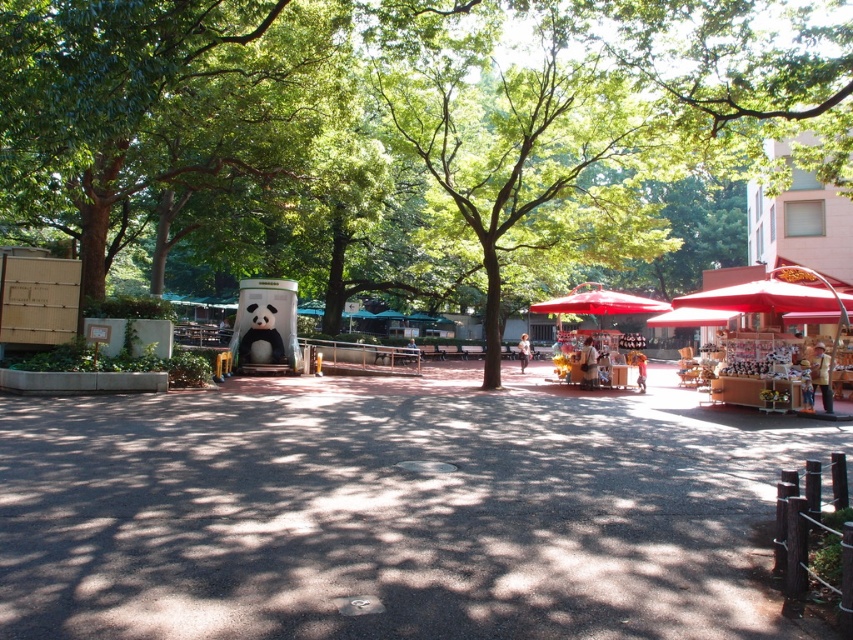
You are standing at the center of the plaza and want to place a new bench. The bench must be placed exactly 2 meters away from the matte red umbrella at center. Which direction should you face to place it?

The answer is north. Since the coordinates of the matte red umbrella at center are given as point [598,301], moving north would place the bench 2 meters away in that direction.

You are a visitor in the park and want to sit under the shade of the green leafy tree at center. However, there is a matte red umbrella at center in the way. Which direction should you move to reach the tree without going near the umbrella?

The green leafy tree at center is to the left of the matte red umbrella at center. To reach the tree without going near the umbrella, you should move to the left side of the matte red umbrella at center.

You are a visitor in the park and want to take a photo of the green leafy tree at center and the matte white vendor at center. Which object should you focus on first if you want to capture both in a single frame without moving the camera?

The green leafy tree at center is larger than the matte white vendor at center, so you should focus on the green leafy tree at center first to ensure it fills the frame appropriately before adjusting for the smaller vendor.